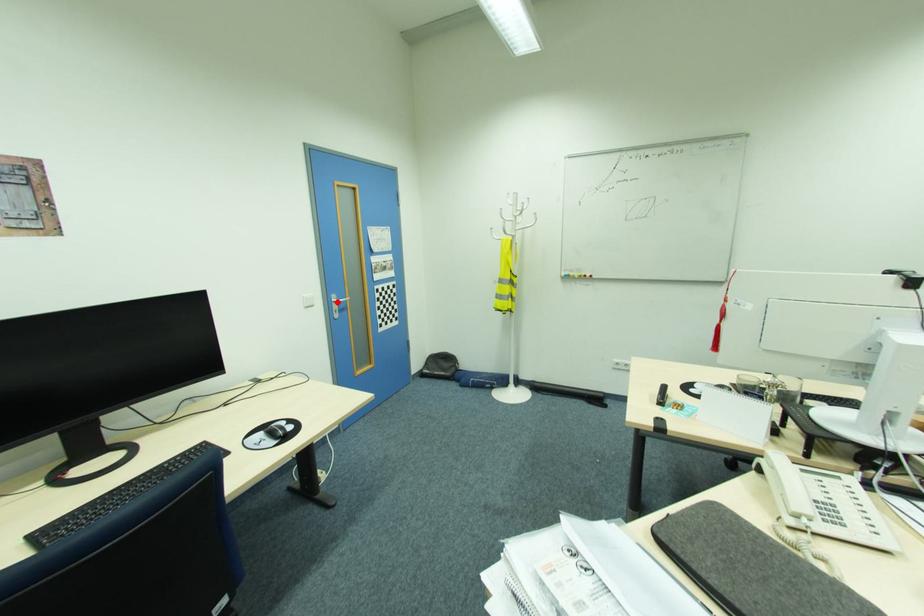
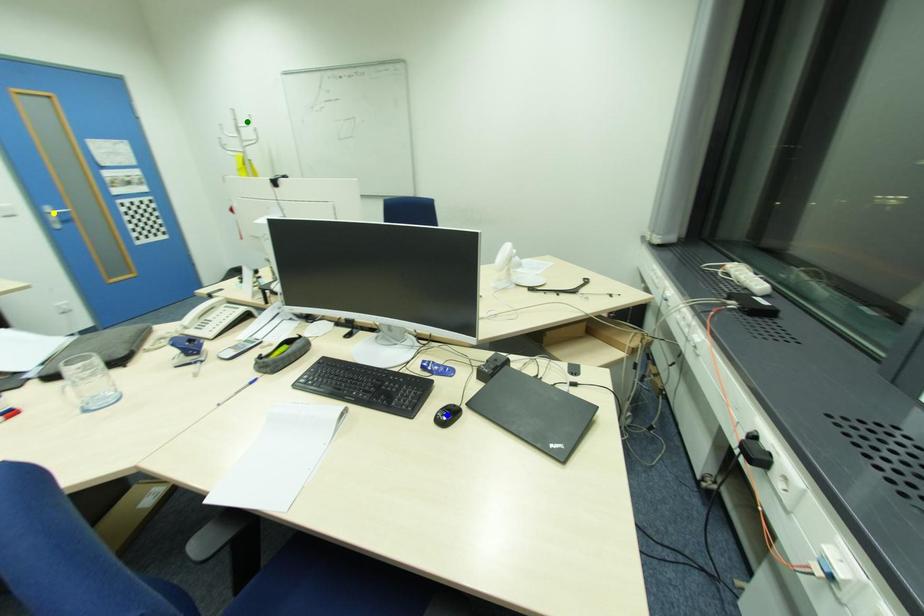
Question: I am providing you with two images of the same scene from different viewpoints. A red point is marked on the first image. You are given multiple points on the second image. Can you choose the point in image 2 that corresponds to the point in image 1?

Choices:
 (A) yellow point
 (B) green point
 (C) blue point

Answer: (A)